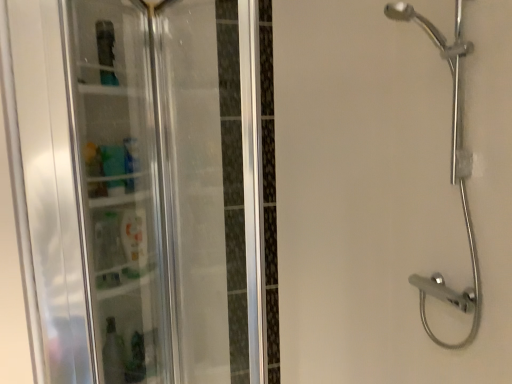
Question: Is chrome metallic shower head at right in front of or behind transparent plastic shelf at left in the image?

Choices:
 (A) behind
 (B) front

Answer: (A)

Question: In terms of height, does chrome metallic shower head at right look taller or shorter compared to transparent plastic shelf at left?

Choices:
 (A) short
 (B) tall

Answer: (B)

Question: Is chrome metallic shower head at right bigger or smaller than transparent plastic shelf at left?

Choices:
 (A) big
 (B) small

Answer: (A)

Question: Considering their positions, is transparent plastic shelf at left located in front of or behind chrome metallic shower head at right?

Choices:
 (A) behind
 (B) front

Answer: (B)

Question: From the image's perspective, is transparent plastic shelf at left above or below chrome metallic shower head at right?

Choices:
 (A) above
 (B) below

Answer: (B)

Question: Is transparent plastic shelf at left inside the boundaries of chrome metallic shower head at right, or outside?

Choices:
 (A) outside
 (B) inside

Answer: (A)

Question: Considering the relative positions of transparent plastic shelf at left and chrome metallic shower head at right in the image provided, is transparent plastic shelf at left to the left or to the right of chrome metallic shower head at right?

Choices:
 (A) right
 (B) left

Answer: (B)